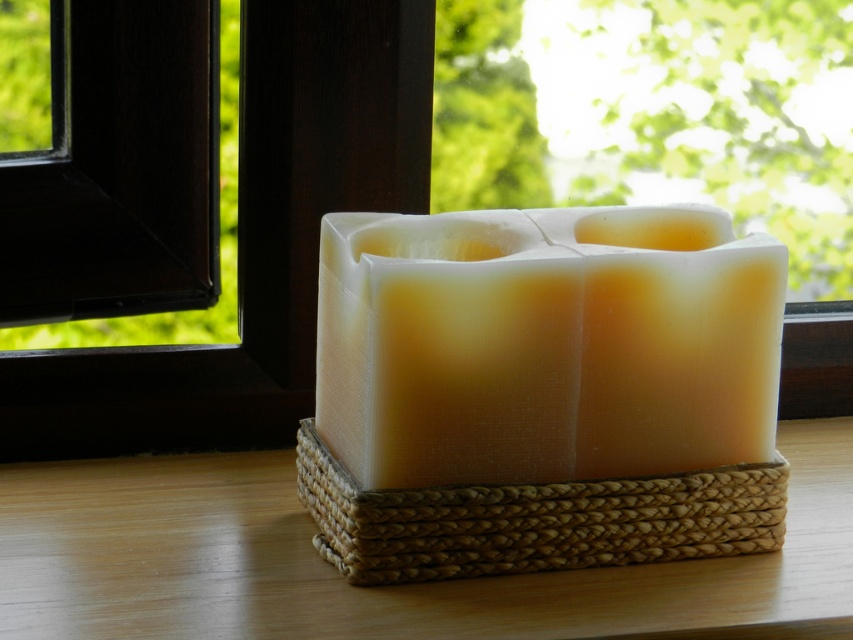
Question: Which object is positioned closest to the translucent wax candle at center?

Choices:
 (A) transparent glass window at center
 (B) wooden table at center

Answer: (B)

Question: Can you confirm if wooden table at center is bigger than woven straw basket at center?

Choices:
 (A) no
 (B) yes

Answer: (B)

Question: Where is transparent glass window at center located in relation to translucent wax candle at center in the image?

Choices:
 (A) above
 (B) below

Answer: (A)

Question: Which point is farther to the camera?

Choices:
 (A) (x=708, y=541)
 (B) (x=596, y=224)
 (C) (x=334, y=602)

Answer: (B)

Question: Is wooden table at center closer to the viewer compared to woven straw basket at center?

Choices:
 (A) no
 (B) yes

Answer: (B)

Question: Among these objects, which one is farthest from the camera?

Choices:
 (A) translucent wax candle at center
 (B) woven straw basket at center

Answer: (B)